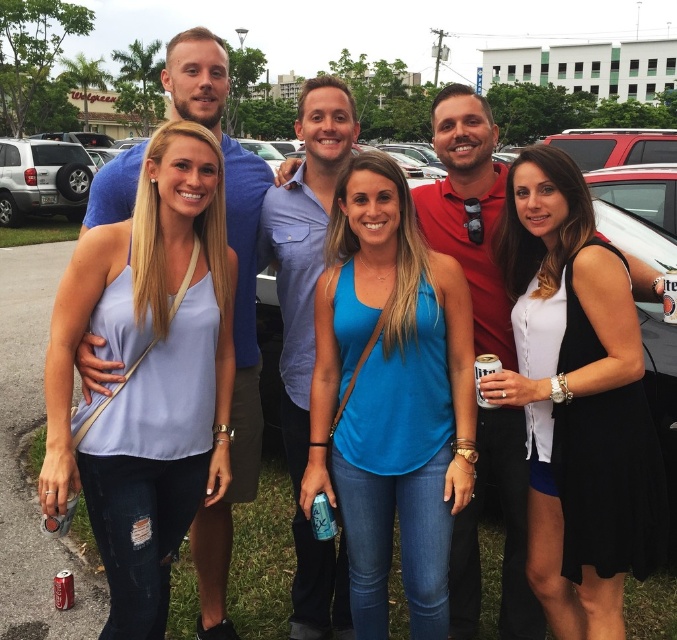
You are a photographer trying to capture a clear photo of both the blue fabric tank top at center and the blue shirt at center. Since both are at the center, which one will appear larger in the photo?

The blue fabric tank top at center is closer to the viewer than the blue shirt at center, so it will appear larger in the photo.